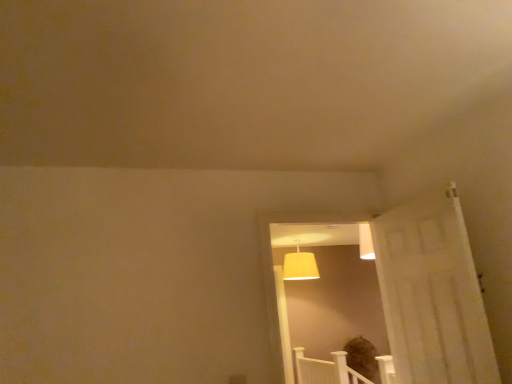
Question: In terms of width, does yellow fabric lampshade at upper center look wider or thinner when compared to matte white door at center?

Choices:
 (A) wide
 (B) thin

Answer: (A)

Question: In the image, is yellow fabric lampshade at upper center on the left side or the right side of matte white door at center?

Choices:
 (A) left
 (B) right

Answer: (B)

Question: Choose the correct answer: Is yellow fabric lampshade at upper center inside matte white door at center or outside it?

Choices:
 (A) inside
 (B) outside

Answer: (B)

Question: Does point (382, 319) appear closer or farther from the camera than point (301, 266)?

Choices:
 (A) farther
 (B) closer

Answer: (B)

Question: From their relative heights in the image, would you say matte white door at center is taller or shorter than yellow fabric lampshade at upper center?

Choices:
 (A) short
 (B) tall

Answer: (B)

Question: Would you say matte white door at center is inside or outside yellow fabric lampshade at upper center?

Choices:
 (A) inside
 (B) outside

Answer: (B)

Question: Considering the relative positions of matte white door at center and yellow fabric lampshade at upper center in the image provided, is matte white door at center to the left or to the right of yellow fabric lampshade at upper center?

Choices:
 (A) right
 (B) left

Answer: (B)